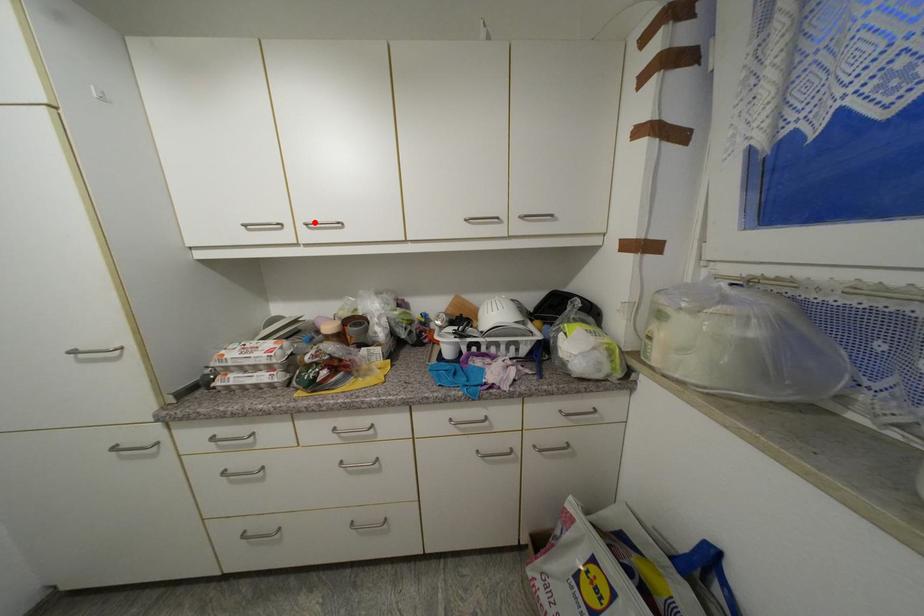
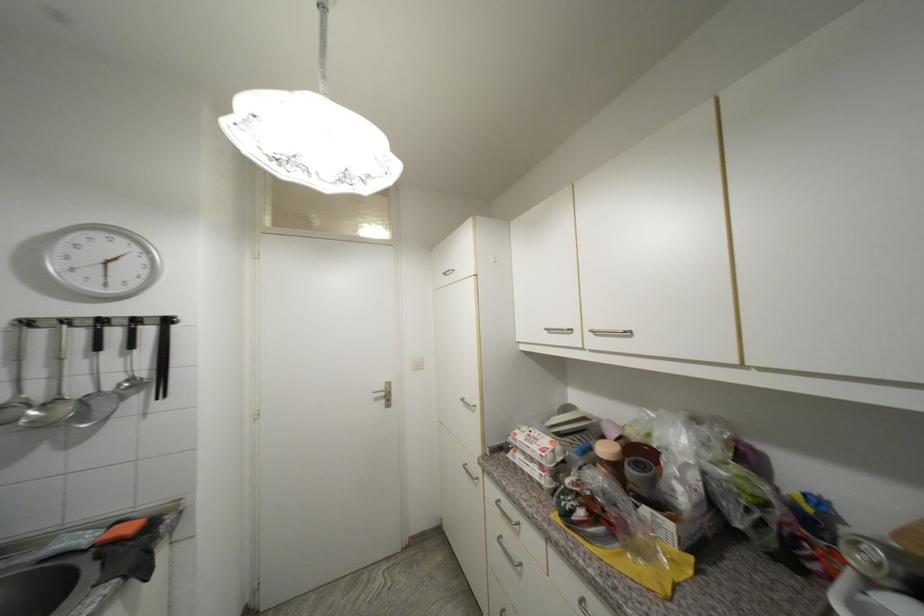
The point at the highlighted location is marked in the first image. Where is the corresponding point in the second image?

(601, 330)